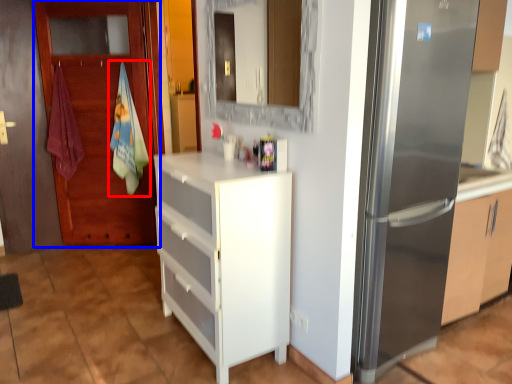
Question: Which object appears closest to the camera in this image, beach towel (highlighted by a red box) or door (highlighted by a blue box)?

Choices:
 (A) beach towel
 (B) door

Answer: (B)